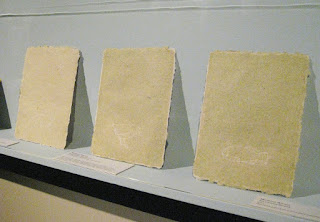
The height and width of the screenshot is (222, 320). I want to click on top of shelf lip, so click(155, 179).